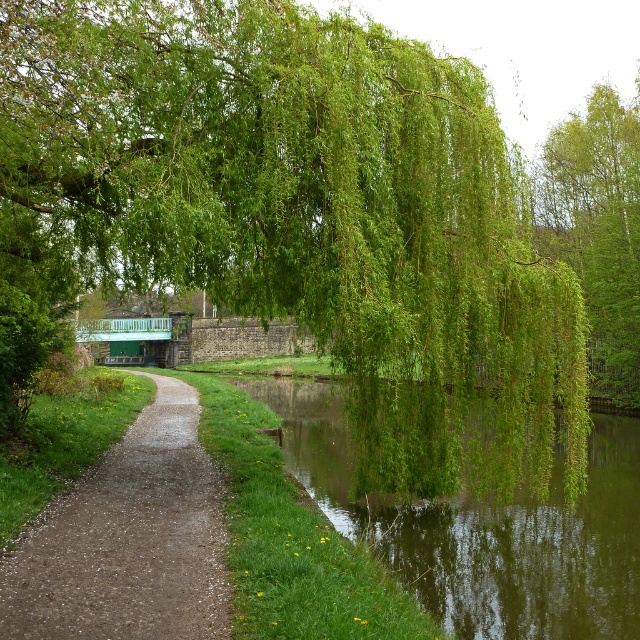
Does green leafy willow at upper center have a greater height compared to gravelly stone path at center?

Indeed, green leafy willow at upper center has a greater height compared to gravelly stone path at center.

Is green leafy willow at upper center thinner than gravelly stone path at center?

In fact, green leafy willow at upper center might be wider than gravelly stone path at center.

Locate an element on the screen. green leafy willow at upper center is located at coordinates (275, 186).

Locate an element on the screen. This screenshot has height=640, width=640. green leafy willow at upper center is located at coordinates (275, 186).

Does green leafy willow at upper center have a greater height compared to green leafy tree at upper right?

No, green leafy willow at upper center is not taller than green leafy tree at upper right.

Which is more to the left, green leafy willow at upper center or green leafy tree at upper right?

green leafy willow at upper center

Measure the distance between point (145, 172) and camera.

They are 8.11 meters apart.

This screenshot has width=640, height=640. In order to click on green leafy willow at upper center in this screenshot , I will do `click(275, 186)`.

Does green leafy river at center have a lesser width compared to green leafy tree at upper right?

No, green leafy river at center is not thinner than green leafy tree at upper right.

Does point (536, 461) lie in front of point (621, 124)?

Yes, point (536, 461) is in front of point (621, 124).

Is point (420, 468) positioned behind point (595, 376)?

No, it is not.

At what (x,y) coordinates should I click in order to perform the action: click on green leafy river at center. Please return your answer as a coordinate pair (x, y). The image size is (640, 640). Looking at the image, I should click on (474, 500).